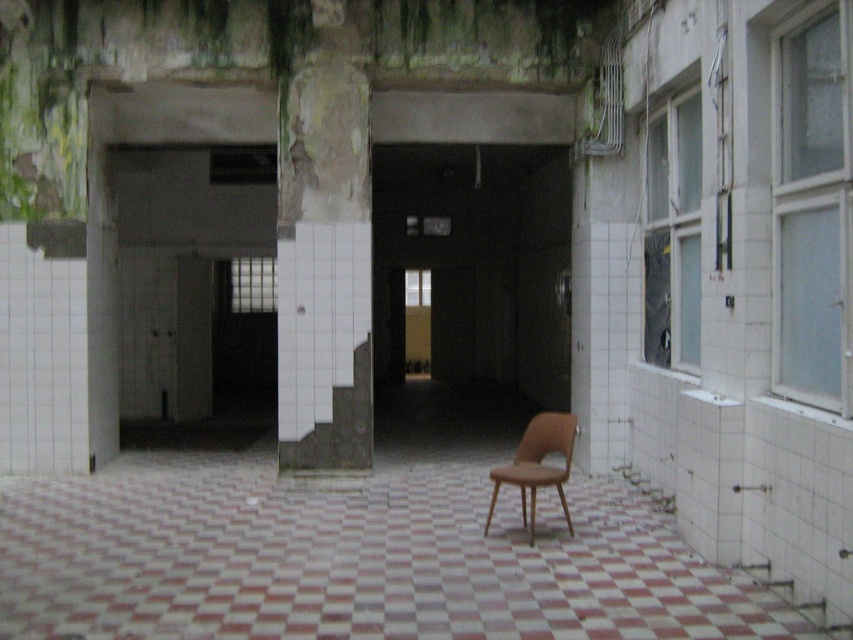
Question: Is white tile pillar at center to the right of brown leather chair at center from the viewer's perspective?

Choices:
 (A) yes
 (B) no

Answer: (B)

Question: Which of these objects is positioned closest to the white checkered tile at center?

Choices:
 (A) white tile pillar at center
 (B) brown leather chair at center

Answer: (B)

Question: Which point is closer to the camera?

Choices:
 (A) (546, 419)
 (B) (387, 492)
 (C) (331, 88)

Answer: (A)

Question: Can you confirm if white checkered tile at center is thinner than white tile pillar at center?

Choices:
 (A) no
 (B) yes

Answer: (A)

Question: Which is nearer to the brown leather chair at center?

Choices:
 (A) white tile pillar at center
 (B) white checkered tile at center

Answer: (B)

Question: In this image, where is white tile pillar at center located relative to brown leather chair at center?

Choices:
 (A) right
 (B) left

Answer: (B)